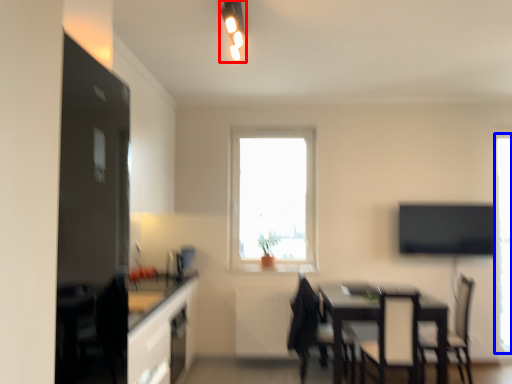
Question: Among these objects, which one is farthest to the camera, light fixture (highlighted by a red box) or window (highlighted by a blue box)?

Choices:
 (A) light fixture
 (B) window

Answer: (B)